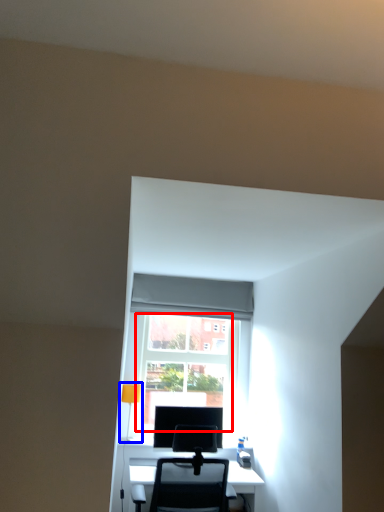
Question: Which point is further to the camera, glass door (highlighted by a red box) or table lamp (highlighted by a blue box)?

Choices:
 (A) glass door
 (B) table lamp

Answer: (A)